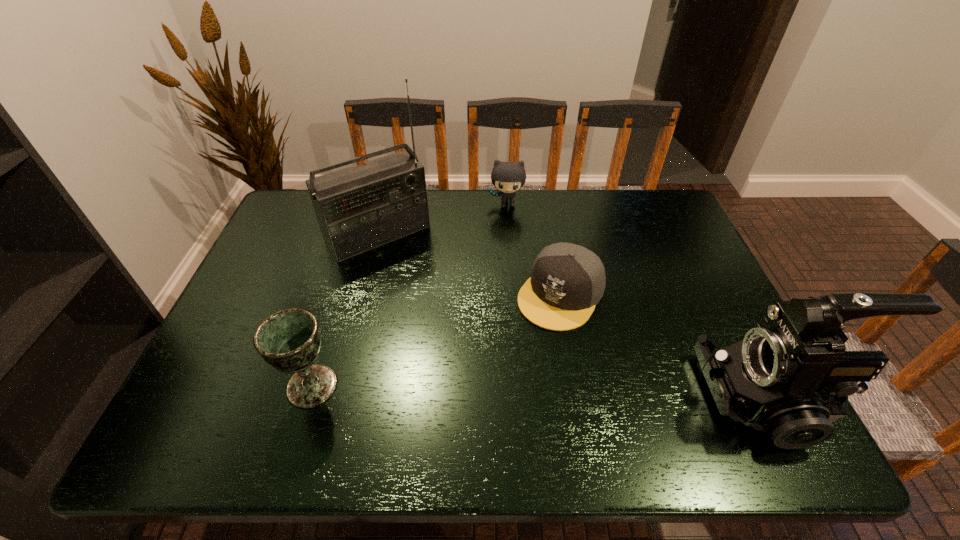
Locate an element on the screen. free space on the desktop that is between the third shortest object and the camcorder and is positioned on the front panel of the radio receiver is located at coordinates (498, 391).

You are a GUI agent. You are given a task and a screenshot of the screen. Output one action in this format:
    pyautogui.click(x=<x>, y=<y>)
    Task: Click on the free space on the desktop that is between the chalice and the fourth shortest object and is positioned on the front-facing side of the cap
    This screenshot has width=960, height=540.
    Given the screenshot: What is the action you would take?
    pyautogui.click(x=492, y=390)

Image resolution: width=960 pixels, height=540 pixels. Identify the location of vacant space on the desktop that is between the chalice and the fourth shortest object and is positioned on the front-facing side of the second shortest object. (496, 390).